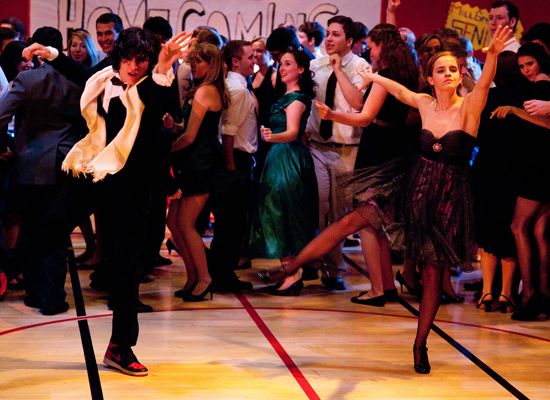
Identify the location of floor. This screenshot has height=400, width=550. (236, 367).